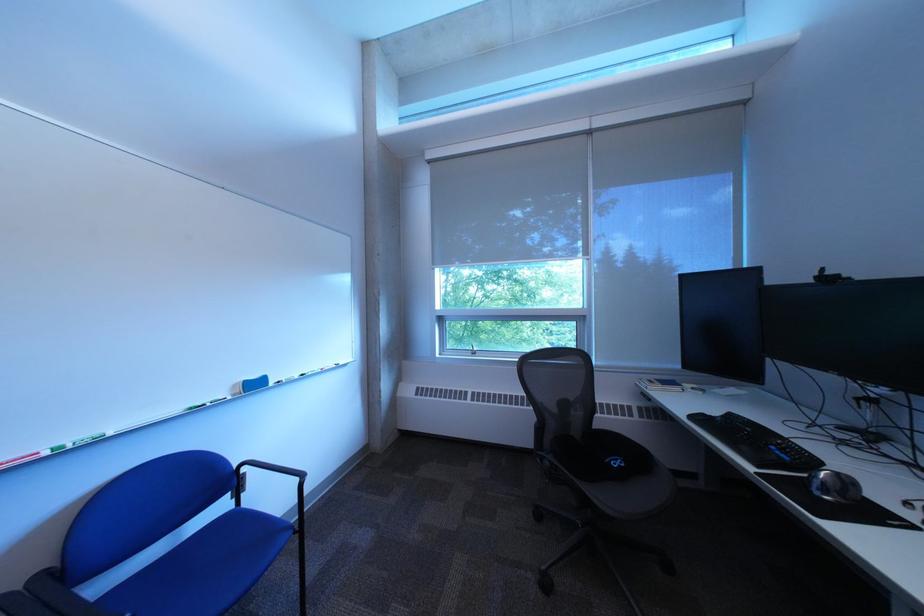
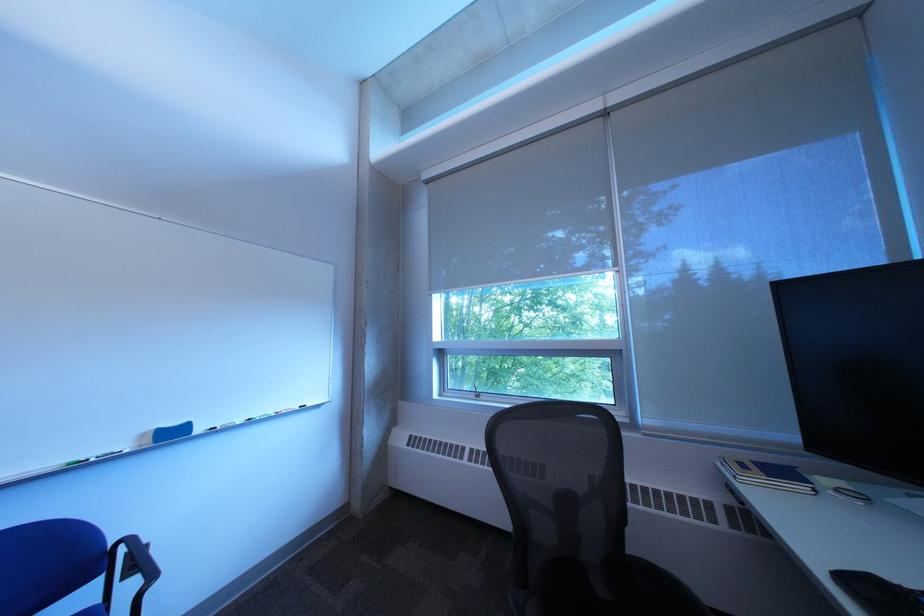
Where in the second image is the point corresponding to (x=249, y=387) from the first image?

(159, 437)